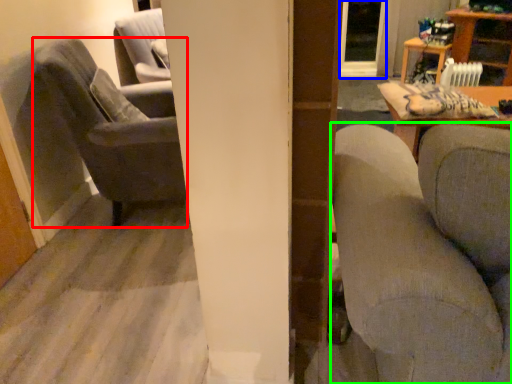
Question: Based on their relative distances, which object is nearer to chair (highlighted by a red box)? Choose from glass door (highlighted by a blue box) and studio couch (highlighted by a green box).

Choices:
 (A) glass door
 (B) studio couch

Answer: (B)